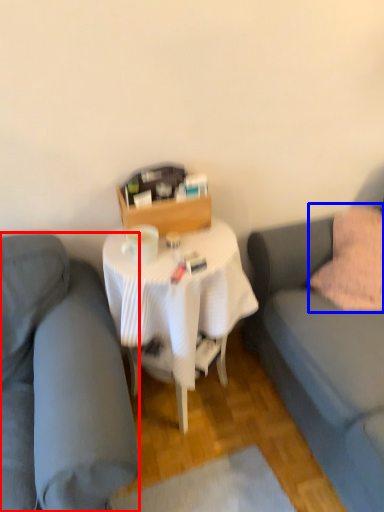
Question: Among these objects, which one is nearest to the camera, studio couch (highlighted by a red box) or throw pillow (highlighted by a blue box)?

Choices:
 (A) studio couch
 (B) throw pillow

Answer: (A)